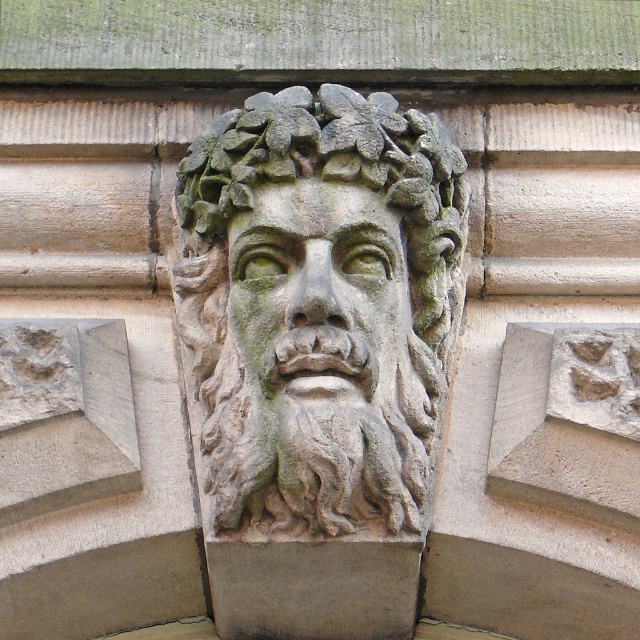
Between point (225, 209) and point (337, 317), which one is positioned behind?

The point (225, 209) is more distant.

What do you see at coordinates (320, 308) in the screenshot? The width and height of the screenshot is (640, 640). I see `green mossy stone face at center` at bounding box center [320, 308].

Is point (397, 154) positioned in front of point (372, 285)?

No, (397, 154) is further to viewer.

What are the coordinates of `green mossy stone face at center` in the screenshot? It's located at (320, 308).